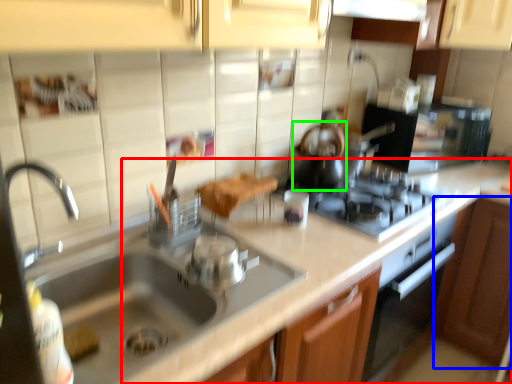
Question: Estimate the real-world distances between objects in this image. Which object is farther from counter top (highlighted by a red box), cabinetry (highlighted by a blue box) or tea pot (highlighted by a green box)?

Choices:
 (A) cabinetry
 (B) tea pot

Answer: (A)